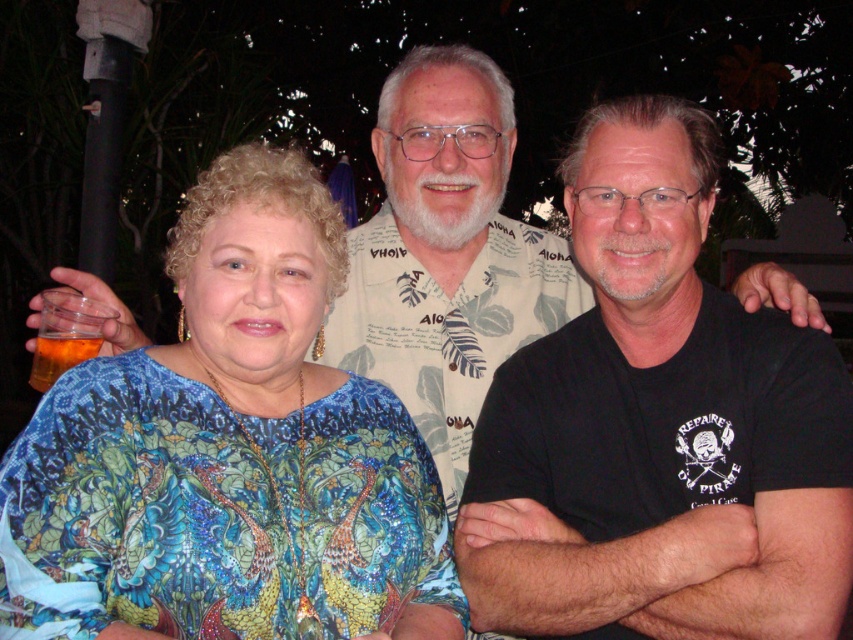
You are at a party and need to choose between the translucent plastic cup at lower left and the translucent amber glass at lower left for a drink. Which one can hold more liquid?

The translucent plastic cup at lower left has a larger size compared to the translucent amber glass at lower left, so it can hold more liquid.

You are a photographer trying to capture a group photo of the shiny blue blouse at center and the printed cotton shirt at center. The camera you are using has a focus range of 24 inches. Will the two subjects be within the focus range?

The shiny blue blouse at center and the printed cotton shirt at center are 24.72 inches apart from each other. Since the focus range is 24 inches, the distance between them exceeds the camera focus range. Therefore, the two subjects will not be within the focus range.